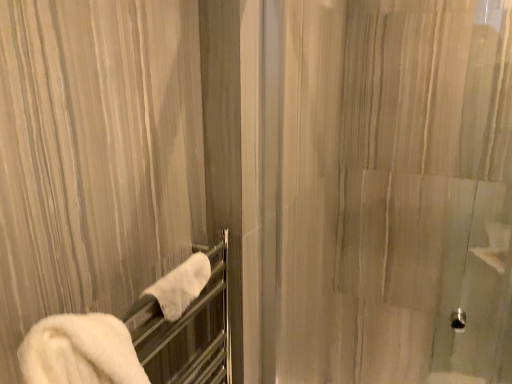
Locate an element on the screen. Image resolution: width=512 pixels, height=384 pixels. translucent glass shower door at center is located at coordinates (395, 192).

Based on the photo, measure the distance between translucent glass shower door at center and camera.

34.35 inches.

Image resolution: width=512 pixels, height=384 pixels. Describe the element at coordinates (395, 192) in the screenshot. I see `translucent glass shower door at center` at that location.

Locate an element on the screen. This screenshot has height=384, width=512. translucent glass shower door at center is located at coordinates (395, 192).